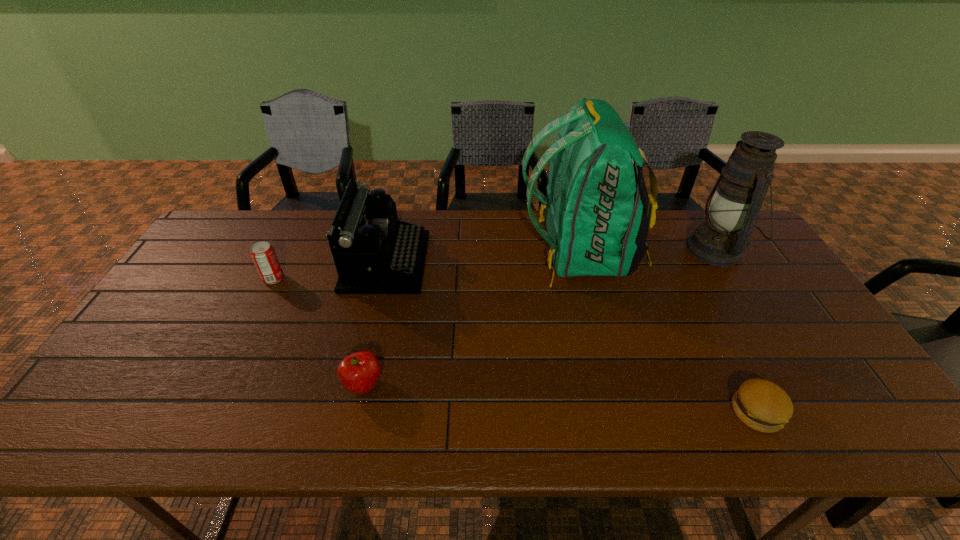
Find the location of a particular element. This screenshot has height=540, width=960. free spot between the hamburger and the leftmost object is located at coordinates (515, 345).

The image size is (960, 540). In order to click on vacant space that's between the fifth shortest object and the leftmost object in this screenshot , I will do `click(494, 264)`.

Find the location of a particular element. Image resolution: width=960 pixels, height=540 pixels. free space between the hamburger and the second tallest object is located at coordinates (736, 330).

I want to click on free space that is in between the fourth shortest object and the apple, so 374,323.

Identify which object is located as the second nearest to the soda can. Please provide its 2D coordinates. Your answer should be formatted as a tuple, i.e. [(x, y)], where the tuple contains the x and y coordinates of a point satisfying the conditions above.

[(359, 372)]

The image size is (960, 540). I want to click on object that ranks as the second closest to the shortest object, so click(x=734, y=203).

This screenshot has height=540, width=960. In order to click on free space that satisfies the following two spatial constraints: 1. on the typing side of the fourth shortest object; 2. on the right side of the shortest object in this screenshot , I will do `click(350, 412)`.

Identify the location of free spot that satisfies the following two spatial constraints: 1. on the front side of the shortest object; 2. on the right side of the apple. (358, 412).

The height and width of the screenshot is (540, 960). Find the location of `blank space that satisfies the following two spatial constraints: 1. on the back side of the oil lamp; 2. on the left side of the apple`. blank space that satisfies the following two spatial constraints: 1. on the back side of the oil lamp; 2. on the left side of the apple is located at coordinates pos(394,249).